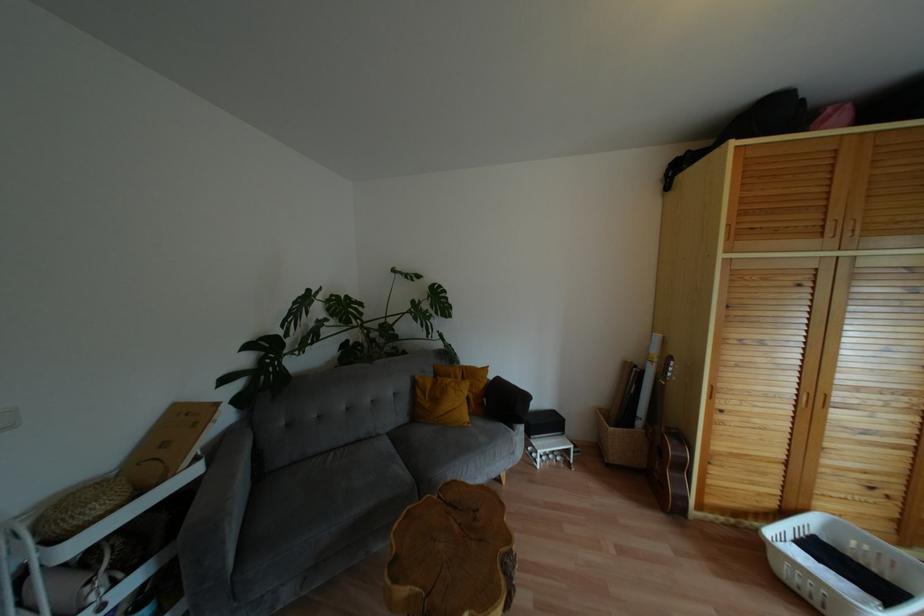
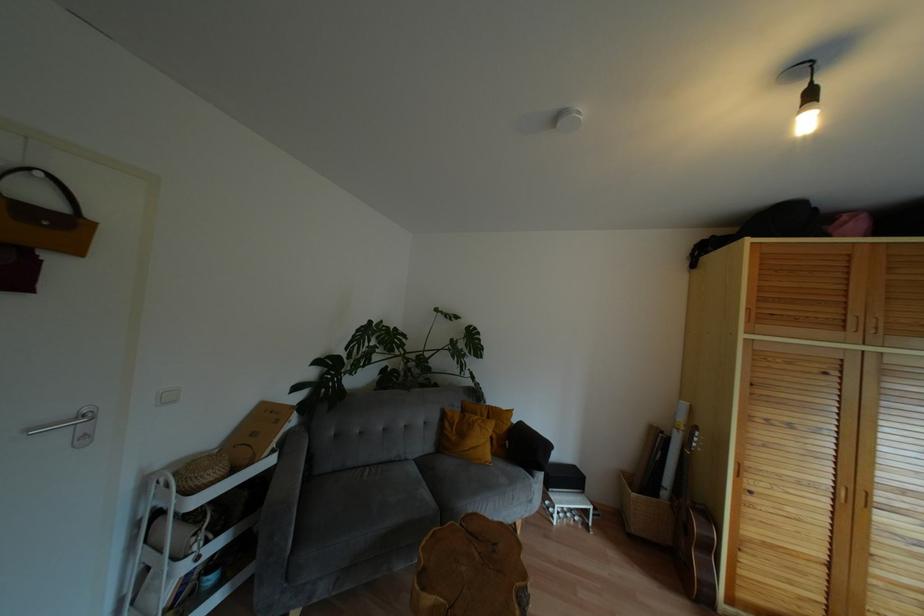
In the second image, find the point that corresponds to the point at 393,450 in the first image.

(419, 476)